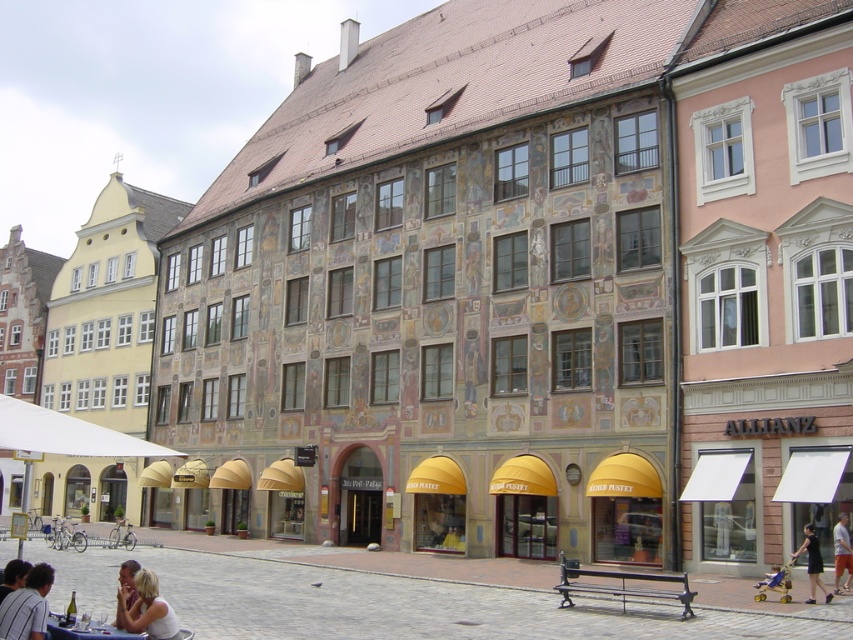
You are a fashion designer observing the European town square scene. You notice a light beige fabric dress at lower left and a smooth skin face at lower left. Which item is positioned higher up in the image?

The light beige fabric dress at lower left is shorter than the smooth skin face at lower left, meaning the smooth skin face at lower left is positioned higher up in the image.

You are a tailor standing in the town square and you need to measure the distance between the light beige fabric dress at lower left and the smooth skin face at lower left. Can you determine if the distance is more than 1.8 meters?

The light beige fabric dress at lower left is 1.96 meters away from the smooth skin face at lower left, so yes, the distance is more than 1.8 meters.

Consider the image. You are standing in the European town square and want to take a photo of the point at coordinates point (3, 618). If your camera has a maximum focus range of 20 meters, will you be able to capture it clearly?

The point (3, 618) is 20.34 meters away from the camera, which exceeds the maximum focus range of 20 meters. Therefore, you won generated by the model. The correct answer is that the distance is 20.34 meters, so the camera cannot focus clearly on the point (3, 618) because it is beyond the 20m limit.